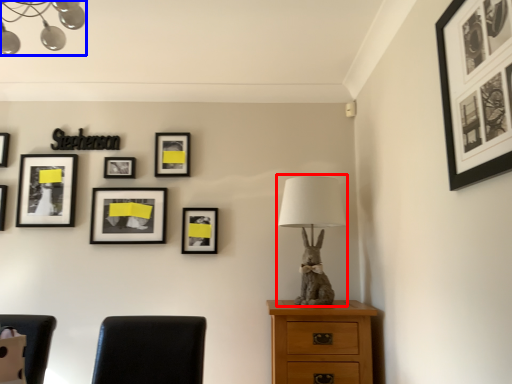
Question: Among these objects, which one is farthest to the camera, table lamp (highlighted by a red box) or lamp (highlighted by a blue box)?

Choices:
 (A) table lamp
 (B) lamp

Answer: (A)